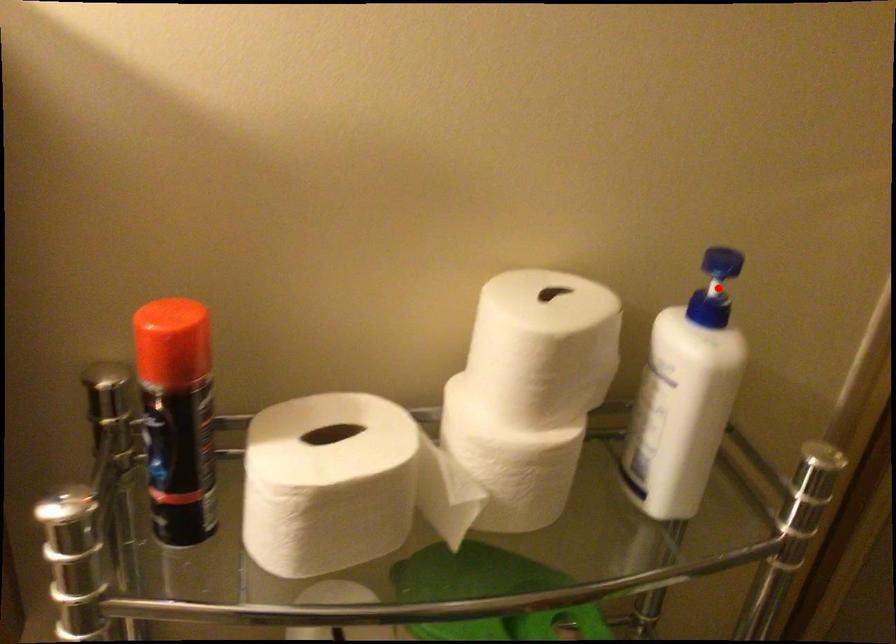
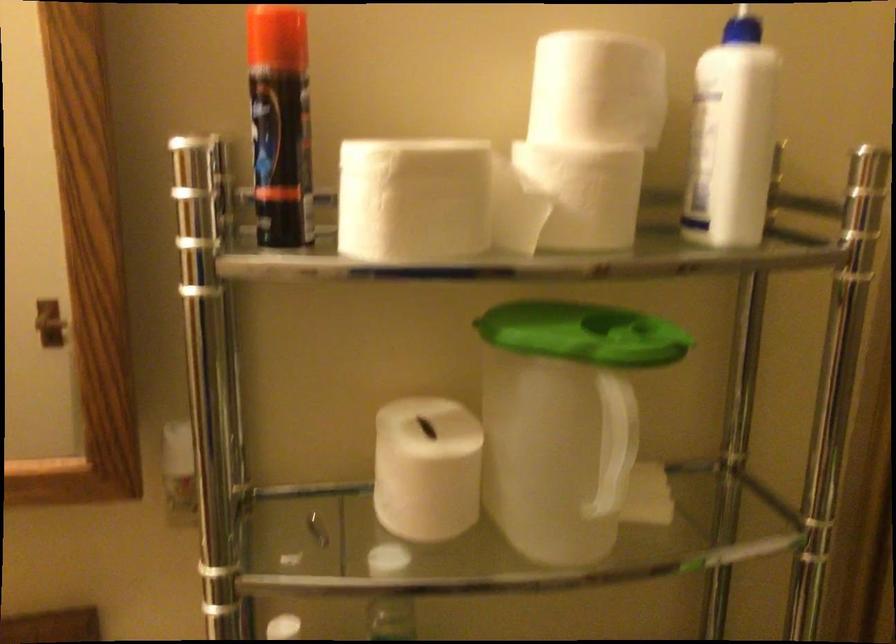
Where in the second image is the point corresponding to the highlighted location from the first image?

(742, 28)